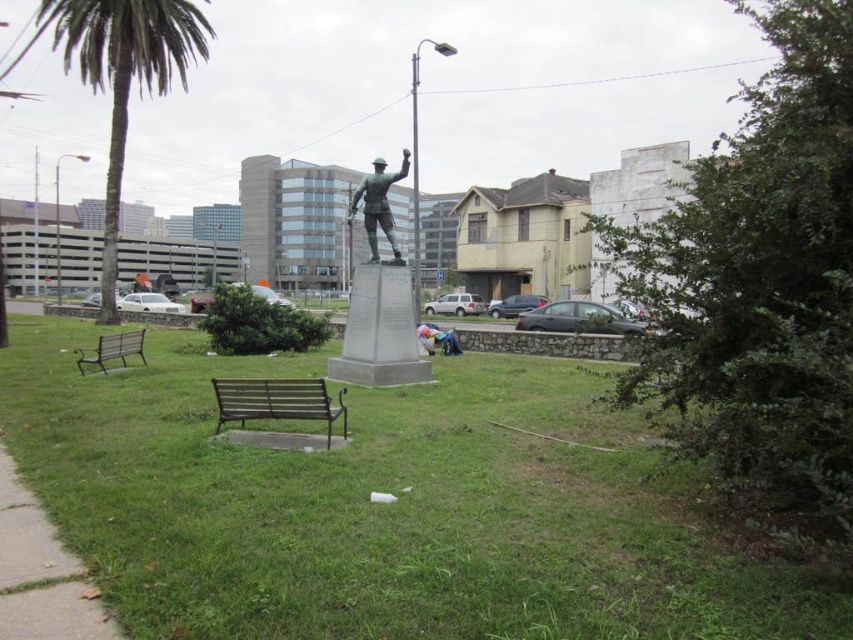
Does green leafy palm tree at left appear on the right side of blue denim jeans at center?

Incorrect, green leafy palm tree at left is not on the right side of blue denim jeans at center.

Which is behind, point (155, 77) or point (426, 324)?

The point (155, 77) is behind.

Is point (74, 22) farther from camera compared to point (436, 339)?

Yes, it is behind point (436, 339).

Locate an element on the screen. The image size is (853, 640). green leafy palm tree at left is located at coordinates (125, 76).

Is gray concrete sidewalk at lower left taller than green polished stone statue at center?

In fact, gray concrete sidewalk at lower left may be shorter than green polished stone statue at center.

Who is more forward, (38, 604) or (389, 236)?

Point (38, 604) is more forward.

At what (x,y) coordinates should I click in order to perform the action: click on gray concrete sidewalk at lower left. Please return your answer as a coordinate pair (x, y). This screenshot has width=853, height=640. Looking at the image, I should click on (41, 573).

How distant is green polished stone statue at center from blue denim jeans at center?

green polished stone statue at center and blue denim jeans at center are 12.32 feet apart from each other.

Can you confirm if green polished stone statue at center is thinner than blue denim jeans at center?

In fact, green polished stone statue at center might be wider than blue denim jeans at center.

Between point (369, 289) and point (445, 346), which one is positioned in front?

Point (369, 289) is more forward.

You are a GUI agent. You are given a task and a screenshot of the screen. Output one action in this format:
    pyautogui.click(x=<x>, y=<y>)
    Task: Click on the green polished stone statue at center
    The height and width of the screenshot is (640, 853).
    Given the screenshot: What is the action you would take?
    pyautogui.click(x=379, y=300)